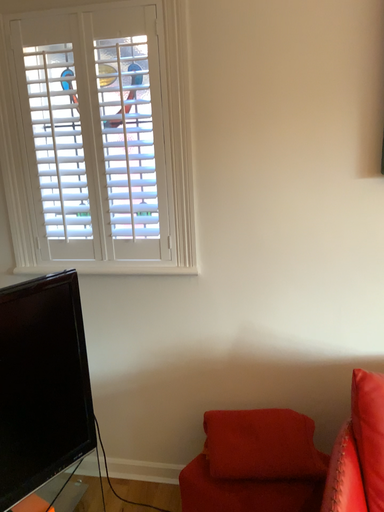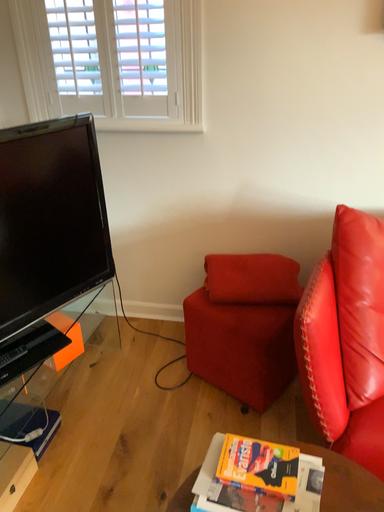
Question: How did the camera likely rotate when shooting the video?

Choices:
 (A) rotated downward
 (B) rotated upward

Answer: (A)